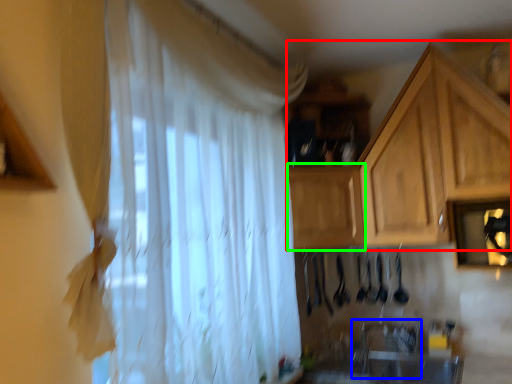
Question: Which is nearer to the cabinetry (highlighted by a red box)? sink (highlighted by a blue box) or cabinetry (highlighted by a green box).

Choices:
 (A) sink
 (B) cabinetry

Answer: (B)